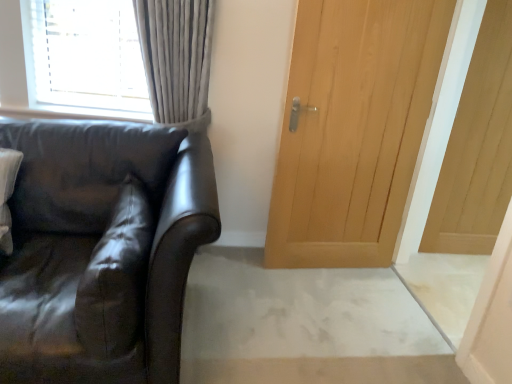
Where is `free space below light wood door at center, acting as the 2th door starting from the right (from a real-world perspective)`? This screenshot has width=512, height=384. free space below light wood door at center, acting as the 2th door starting from the right (from a real-world perspective) is located at coordinates (328, 268).